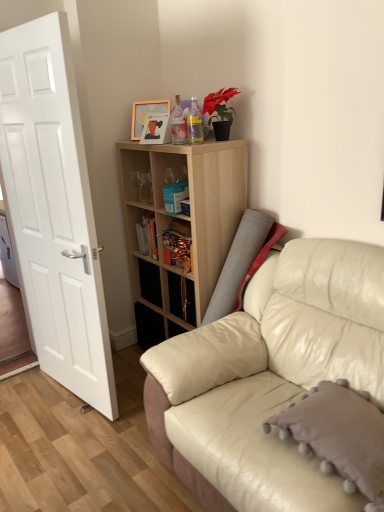
Question: From the image's perspective, is hardcover book at center, the 2th book viewed from the top, on leather couch at right?

Choices:
 (A) yes
 (B) no

Answer: (A)

Question: Could you tell me if hardcover book at center, which is counted as the 1th book, starting from the left, is turned towards leather couch at right?

Choices:
 (A) no
 (B) yes

Answer: (A)

Question: From the image's perspective, is hardcover book at center, the 1th book positioned from the bottom, below leather couch at right?

Choices:
 (A) no
 (B) yes

Answer: (A)

Question: Can you confirm if hardcover book at center, the 2th book viewed from the top, is taller than leather couch at right?

Choices:
 (A) yes
 (B) no

Answer: (B)

Question: Can you confirm if hardcover book at center, the 1th book positioned from the bottom, is wider than leather couch at right?

Choices:
 (A) no
 (B) yes

Answer: (A)

Question: From a real-world perspective, relative to blue matte bookshelf at center, positioned as the 2th book in back-to-front order, is translucent plastic bottle at upper center, the 1th bottle positioned from the left, vertically above or below?

Choices:
 (A) below
 (B) above

Answer: (B)

Question: Based on their positions, is translucent plastic bottle at upper center, which is the 2th bottle in right-to-left order, located to the left or right of blue matte bookshelf at center, marked as the first book in a front-to-back arrangement?

Choices:
 (A) right
 (B) left

Answer: (A)

Question: Looking at their shapes, would you say translucent plastic bottle at upper center, the 1th bottle positioned from the left, is wider or thinner than blue matte bookshelf at center, the first book viewed from the right?

Choices:
 (A) thin
 (B) wide

Answer: (A)

Question: Do you think translucent plastic bottle at upper center, which is the 2th bottle in right-to-left order, is within blue matte bookshelf at center, acting as the second book starting from the left, or outside of it?

Choices:
 (A) inside
 (B) outside

Answer: (B)

Question: In the image, is blue matte bookshelf at center, positioned as the 2th book in back-to-front order, positioned in front of or behind white matte door at left?

Choices:
 (A) behind
 (B) front

Answer: (A)

Question: Considering the positions of blue matte bookshelf at center, acting as the 2th book starting from the bottom, and white matte door at left in the image, is blue matte bookshelf at center, acting as the 2th book starting from the bottom, bigger or smaller than white matte door at left?

Choices:
 (A) big
 (B) small

Answer: (B)

Question: From a real-world perspective, is blue matte bookshelf at center, acting as the 2th book starting from the bottom, above or below white matte door at left?

Choices:
 (A) below
 (B) above

Answer: (B)

Question: Looking at their shapes, would you say blue matte bookshelf at center, which is the 1th book in top-to-bottom order, is wider or thinner than white matte door at left?

Choices:
 (A) wide
 (B) thin

Answer: (A)

Question: Relative to hardcover book at center, the 2th book viewed from the top, is translucent plastic bottle at upper center, the 1th bottle positioned from the left, in front or behind?

Choices:
 (A) behind
 (B) front

Answer: (B)

Question: Choose the correct answer: Is translucent plastic bottle at upper center, the 1th bottle positioned from the left, inside hardcover book at center, placed as the 2th book when sorted from front to back, or outside it?

Choices:
 (A) inside
 (B) outside

Answer: (B)